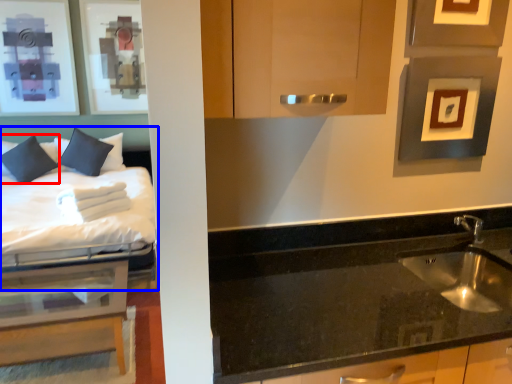
Question: Which point is further to the camera, pillow (highlighted by a red box) or bed (highlighted by a blue box)?

Choices:
 (A) pillow
 (B) bed

Answer: (A)